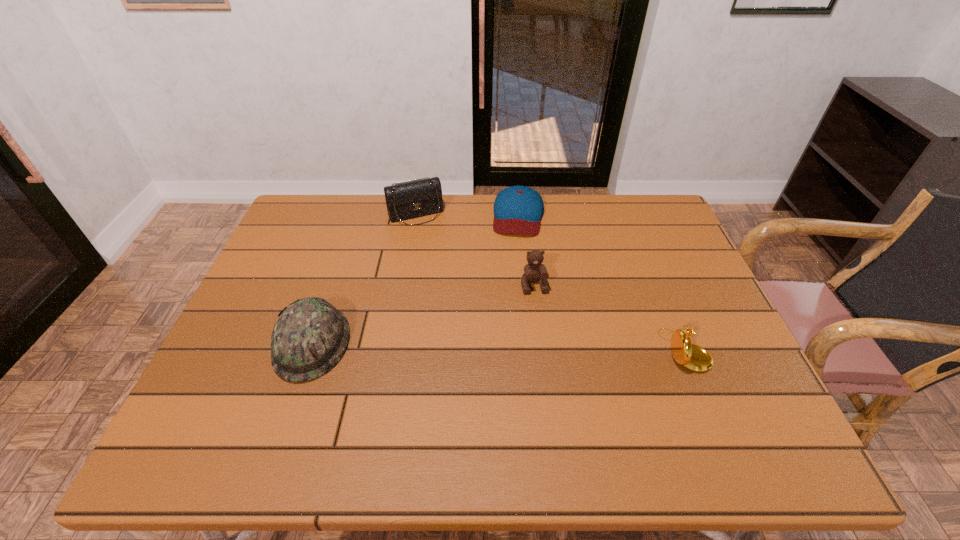
At what (x,y) coordinates should I click in order to perform the action: click on vacant region that satisfies the following two spatial constraints: 1. on the back side of the shortest object; 2. on the left side of the leftmost object. Please return your answer as a coordinate pair (x, y). This screenshot has height=540, width=960. Looking at the image, I should click on (356, 215).

Where is `vacant space that satisfies the following two spatial constraints: 1. on the front side of the baseball cap; 2. on the face of the pocket watch`? This screenshot has width=960, height=540. vacant space that satisfies the following two spatial constraints: 1. on the front side of the baseball cap; 2. on the face of the pocket watch is located at coordinates (533, 350).

You are a GUI agent. You are given a task and a screenshot of the screen. Output one action in this format:
    pyautogui.click(x=<x>, y=<y>)
    Task: Click on the vacant space that satisfies the following two spatial constraints: 1. on the front side of the teddy bear; 2. on the face of the pocket watch
    The height and width of the screenshot is (540, 960).
    Given the screenshot: What is the action you would take?
    pyautogui.click(x=542, y=350)

Find the location of `vacant space that satisfies the following two spatial constraints: 1. on the front side of the pocket watch; 2. on the face of the clutch bag`. vacant space that satisfies the following two spatial constraints: 1. on the front side of the pocket watch; 2. on the face of the clutch bag is located at coordinates (392, 350).

Locate an element on the screen. The width and height of the screenshot is (960, 540). vacant space that satisfies the following two spatial constraints: 1. on the front side of the pocket watch; 2. on the face of the headwear is located at coordinates (310, 350).